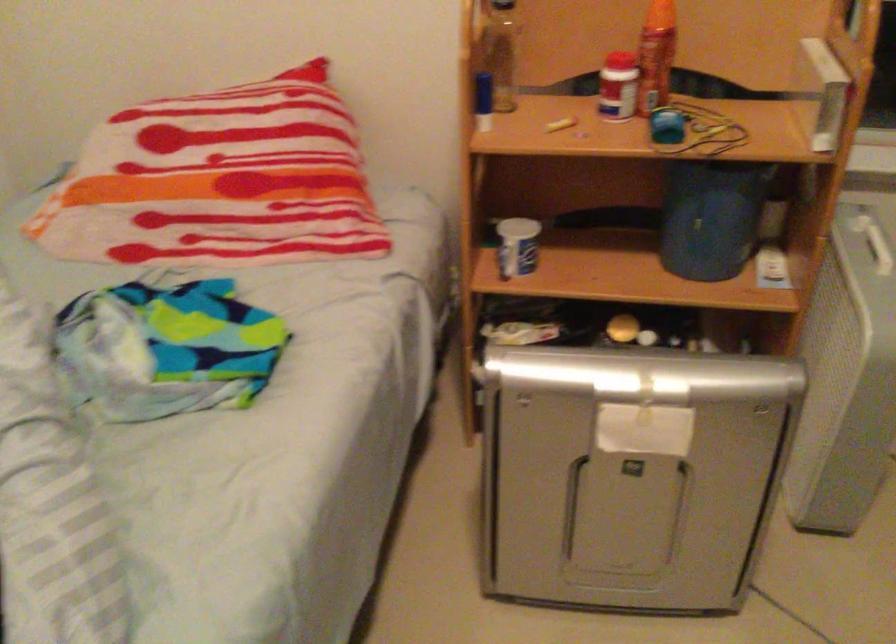
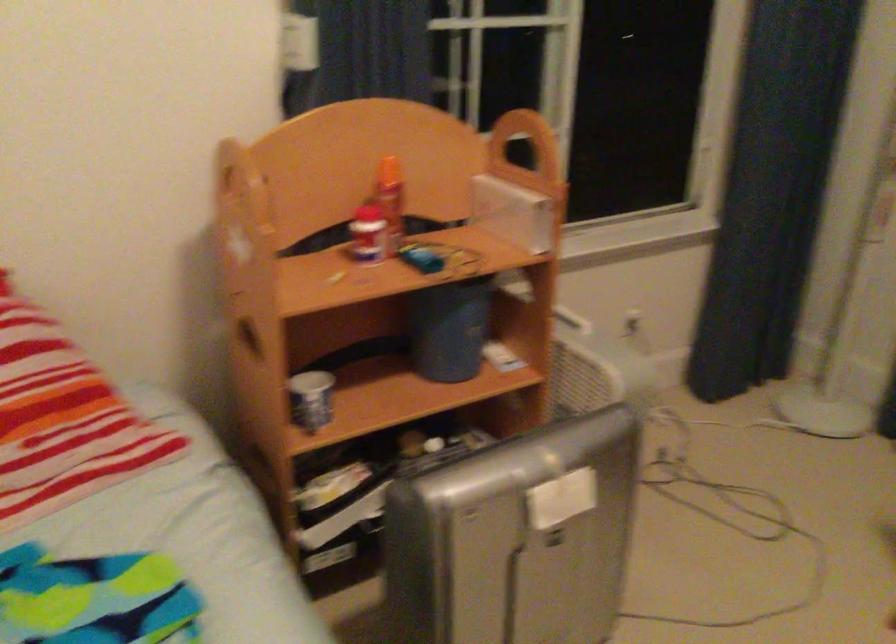
Question: The camera is either moving clockwise (left) or counter-clockwise (right) around the object. The first image is from the beginning of the video and the second image is from the end. Is the camera moving left or right when shooting the video?

Choices:
 (A) Left
 (B) Right

Answer: (A)